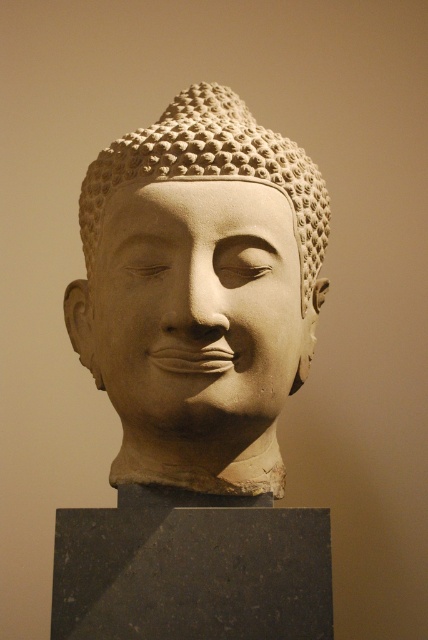
Who is more distant from viewer, (122, 436) or (125, 205)?

Point (122, 436)

You are a GUI agent. You are given a task and a screenshot of the screen. Output one action in this format:
    pyautogui.click(x=<x>, y=<y>)
    Task: Click on the white stone buddha head at center
    
    Given the screenshot: What is the action you would take?
    pyautogui.click(x=199, y=291)